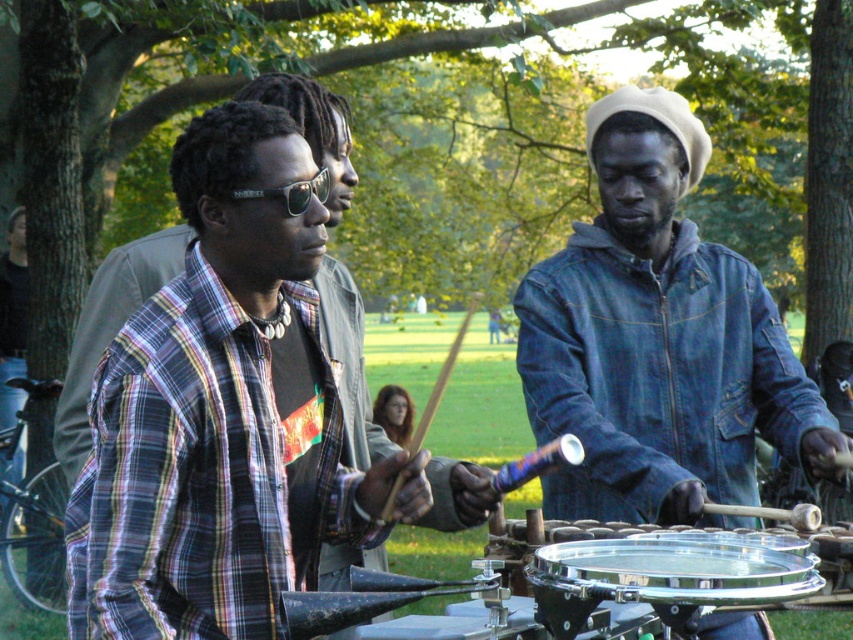
Which of these two, denim jacket at center or shiny metallic drum at center, stands shorter?

Standing shorter between the two is shiny metallic drum at center.

Between denim jacket at center and shiny metallic drum at center, which one appears on the right side from the viewer's perspective?

Positioned to the right is denim jacket at center.

Describe the element at coordinates (659, 340) in the screenshot. I see `denim jacket at center` at that location.

Identify the location of denim jacket at center. The image size is (853, 640). (659, 340).